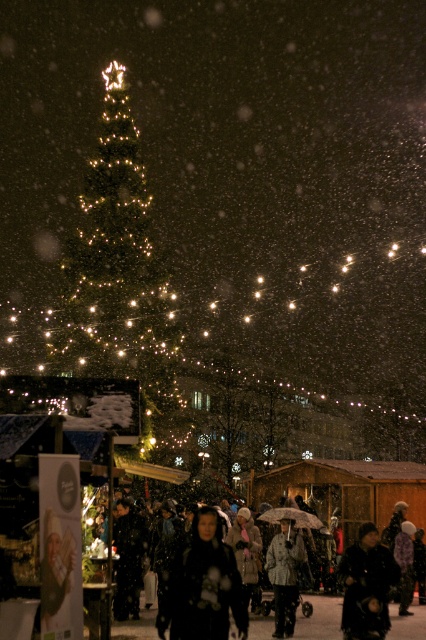
You are standing at the Christmas market and want to take a photo of both the point at coordinates point (x=132, y=612) and the point at coordinates point (x=279, y=579). Which point should you focus on first to ensure both are in focus?

You should focus on point (x=132, y=612) first because it is closer to the camera than point (x=279, y=579). This way, both points will be within the depth of field.